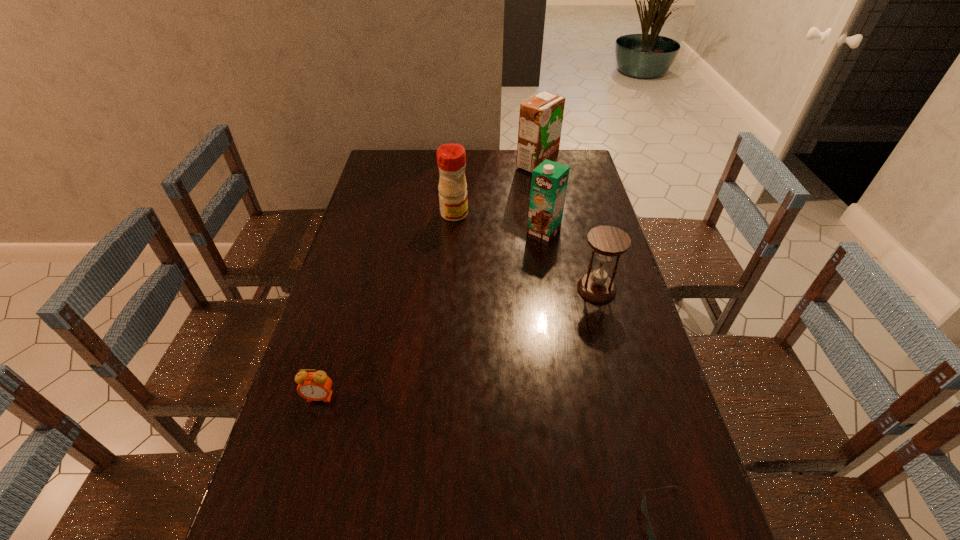
Where is `the farther carton`? The image size is (960, 540). the farther carton is located at coordinates (540, 120).

This screenshot has height=540, width=960. Find the location of `the fifth object from right to left`. the fifth object from right to left is located at coordinates (451, 158).

Identify the location of the nearer carton. This screenshot has width=960, height=540. (549, 182).

This screenshot has width=960, height=540. What are the coordinates of `the fourth farthest object` in the screenshot? It's located at (607, 241).

At what (x,y) coordinates should I click in order to perform the action: click on hourglass. Please return your answer as a coordinate pair (x, y). Image resolution: width=960 pixels, height=540 pixels. Looking at the image, I should click on (607, 241).

Identify the location of the fifth farthest object. (314, 386).

Locate an element on the screen. The width and height of the screenshot is (960, 540). the leftmost object is located at coordinates (314, 386).

Identify the location of vacant space located 0.280m on the straw side of the farther carton. pos(449,165).

This screenshot has width=960, height=540. I want to click on free space located 0.380m on the straw side of the farther carton, so click(426, 165).

Locate an element on the screen. This screenshot has width=960, height=540. free space located on the straw side of the farther carton is located at coordinates (433, 165).